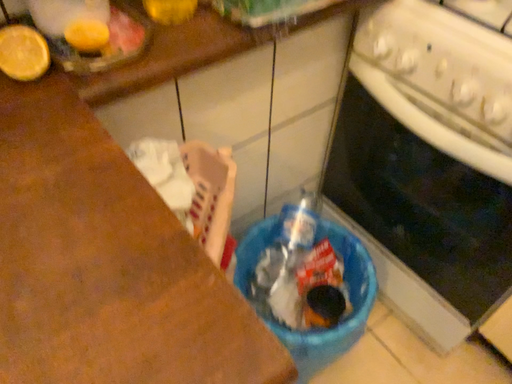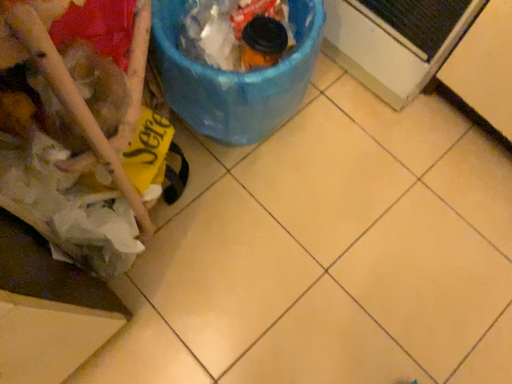
Question: Which way did the camera rotate in the video?

Choices:
 (A) rotated downward
 (B) rotated upward

Answer: (A)